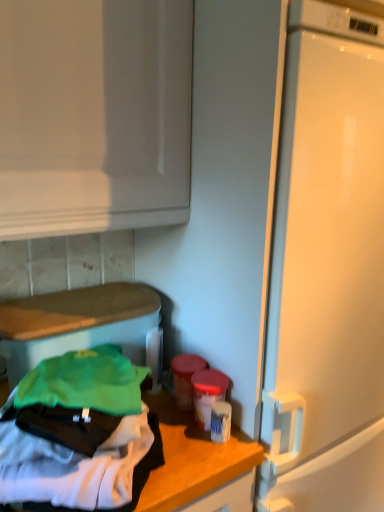
Question: Does white matte countertop at lower left contain matte green fabric at lower left?

Choices:
 (A) yes
 (B) no

Answer: (B)

Question: From a real-world perspective, is white matte countertop at lower left physically below matte green fabric at lower left?

Choices:
 (A) yes
 (B) no

Answer: (A)

Question: Is white matte countertop at lower left with matte green fabric at lower left?

Choices:
 (A) no
 (B) yes

Answer: (A)

Question: Can you confirm if white matte countertop at lower left is wider than matte green fabric at lower left?

Choices:
 (A) yes
 (B) no

Answer: (A)

Question: Is white matte countertop at lower left facing towards matte green fabric at lower left?

Choices:
 (A) yes
 (B) no

Answer: (B)

Question: Is white matte countertop at lower left turned away from matte green fabric at lower left?

Choices:
 (A) yes
 (B) no

Answer: (A)

Question: Does matte green fabric at lower left have a lesser width compared to white matte countertop at lower left?

Choices:
 (A) yes
 (B) no

Answer: (A)

Question: Would you say matte green fabric at lower left contains white matte countertop at lower left?

Choices:
 (A) no
 (B) yes

Answer: (A)

Question: Is matte green fabric at lower left at the right side of white matte countertop at lower left?

Choices:
 (A) yes
 (B) no

Answer: (B)

Question: Is matte green fabric at lower left not near white matte countertop at lower left?

Choices:
 (A) yes
 (B) no

Answer: (B)

Question: Is matte green fabric at lower left in contact with white matte countertop at lower left?

Choices:
 (A) no
 (B) yes

Answer: (A)

Question: Considering the relative sizes of matte green fabric at lower left and white matte countertop at lower left in the image provided, is matte green fabric at lower left smaller than white matte countertop at lower left?

Choices:
 (A) no
 (B) yes

Answer: (A)

Question: Choose the correct answer: Is matte green fabric at lower left inside white matte countertop at lower left or outside it?

Choices:
 (A) outside
 (B) inside

Answer: (A)